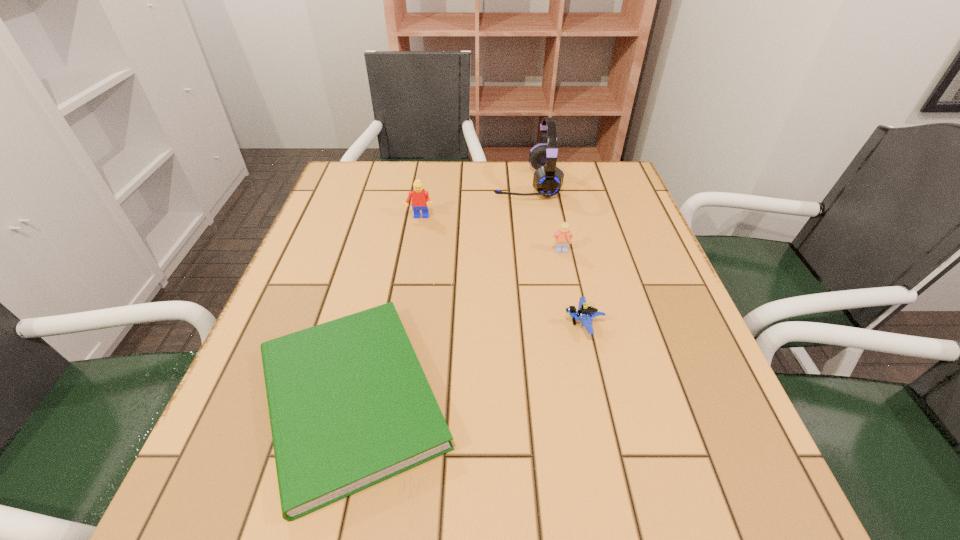
The image size is (960, 540). Identify the location of free space between the paperback book and the fourth tallest object. (468, 361).

I want to click on vacant area that lies between the shortest object and the farthest object, so click(x=439, y=291).

Locate an element on the screen. The image size is (960, 540). vacant region between the second tallest Lego and the farthest object is located at coordinates (543, 217).

Locate an element on the screen. unoccupied area between the second nearest Lego and the fourth nearest object is located at coordinates (491, 234).

At what (x,y) coordinates should I click in order to perform the action: click on vacant space that is in between the leftmost Lego and the second farthest Lego. Please return your answer as a coordinate pair (x, y). This screenshot has width=960, height=540. Looking at the image, I should click on (491, 234).

The width and height of the screenshot is (960, 540). Identify the location of empty location between the second farthest object and the nearest Lego. (501, 271).

Where is `vacant space that's between the farthest Lego and the nearest Lego`? The height and width of the screenshot is (540, 960). vacant space that's between the farthest Lego and the nearest Lego is located at coordinates (501, 271).

Locate an element on the screen. the second closest object to the tallest object is located at coordinates (562, 238).

Locate an element on the screen. This screenshot has height=540, width=960. object that is the fourth closest one to the headset is located at coordinates click(349, 404).

At what (x,y) coordinates should I click in order to perform the action: click on the closest Lego to the second tallest Lego. Please return your answer as a coordinate pair (x, y). Looking at the image, I should click on (585, 313).